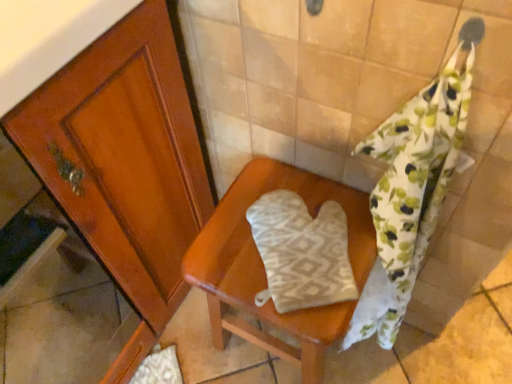
Identify the location of vacant space to the left of white textured oven mitt at center. click(229, 257).